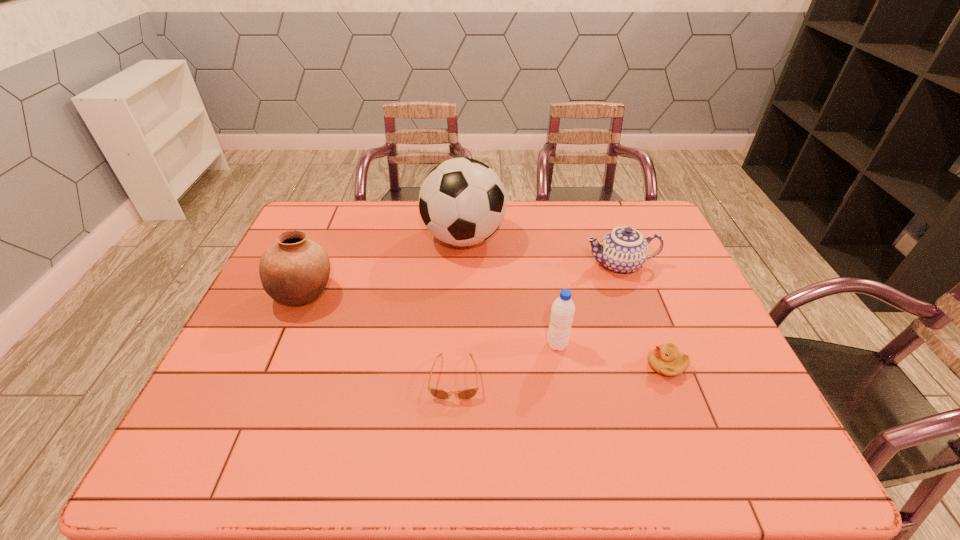
At what (x,y) coordinates should I click in order to perform the action: click on soccer ball. Please return your answer as a coordinate pair (x, y). Image resolution: width=960 pixels, height=540 pixels. Looking at the image, I should click on (462, 202).

Locate an element on the screen. pottery is located at coordinates (295, 270).

Locate an element on the screen. This screenshot has height=540, width=960. water bottle is located at coordinates (562, 312).

Locate an element on the screen. The height and width of the screenshot is (540, 960). the third shortest object is located at coordinates (623, 250).

Locate an element on the screen. the second shortest object is located at coordinates (666, 360).

Find the location of a particular element. The height and width of the screenshot is (540, 960). sunglasses is located at coordinates (465, 394).

This screenshot has height=540, width=960. Find the location of `vacant space located on the right of the tallest object`. vacant space located on the right of the tallest object is located at coordinates click(x=578, y=238).

The width and height of the screenshot is (960, 540). Find the location of `vacant region located on the right of the pottery`. vacant region located on the right of the pottery is located at coordinates (449, 294).

Locate an element on the screen. vacant space located 0.130m on the right of the water bottle is located at coordinates (619, 345).

The width and height of the screenshot is (960, 540). What are the coordinates of `vacant space located 0.130m from the spout of the third shortest object` in the screenshot? It's located at (539, 265).